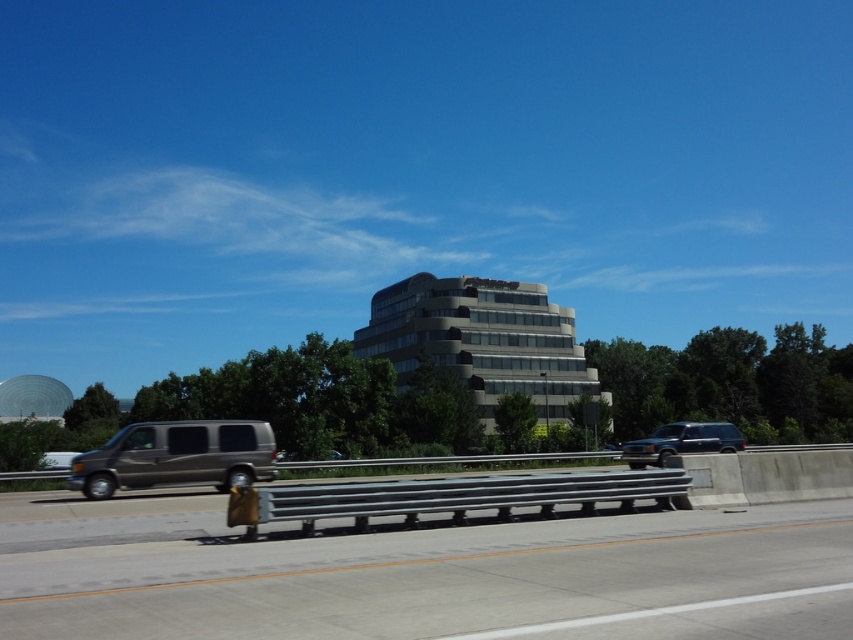
Is matte metallic van at lower left shorter than metallic gray suv at right?

Correct, matte metallic van at lower left is not as tall as metallic gray suv at right.

How distant is matte metallic van at lower left from metallic gray suv at right?

matte metallic van at lower left is 15.76 meters from metallic gray suv at right.

The image size is (853, 640). What do you see at coordinates (177, 456) in the screenshot?
I see `matte metallic van at lower left` at bounding box center [177, 456].

Find the location of `matte metallic van at lower left`. matte metallic van at lower left is located at coordinates (177, 456).

At what (x,y) coordinates should I click in order to perform the action: click on gray concrete barrier at lower center. Please return your answer as a coordinate pair (x, y). This screenshot has height=640, width=853. Looking at the image, I should click on point(456,580).

Who is more distant from viewer, (170,566) or (715,428)?

The point (715,428) is more distant.

Where is `gray concrete barrier at lower center`? gray concrete barrier at lower center is located at coordinates (456, 580).

Find the location of a particular element. gray concrete barrier at lower center is located at coordinates click(x=456, y=580).

Is point (253, 563) positioned behind point (184, 433)?

No, (253, 563) is closer to viewer.

The width and height of the screenshot is (853, 640). I want to click on gray concrete barrier at lower center, so click(x=456, y=580).